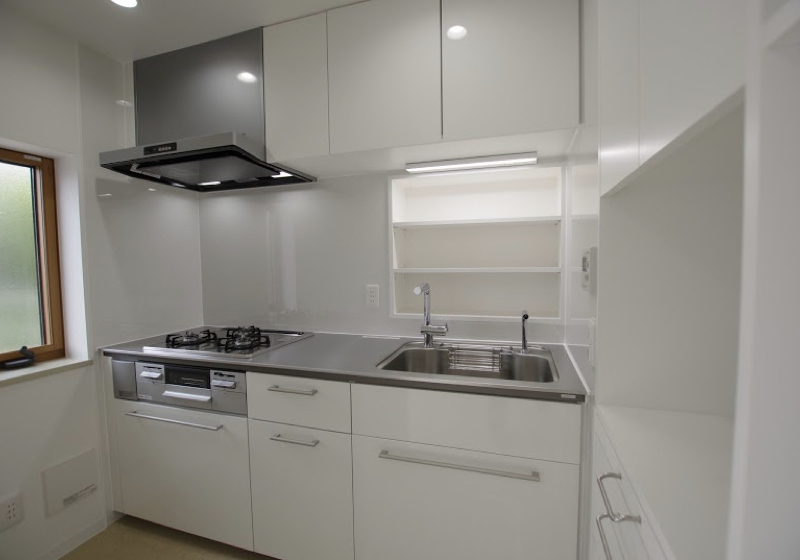
Where is `fan`? The image size is (800, 560). fan is located at coordinates (214, 175).